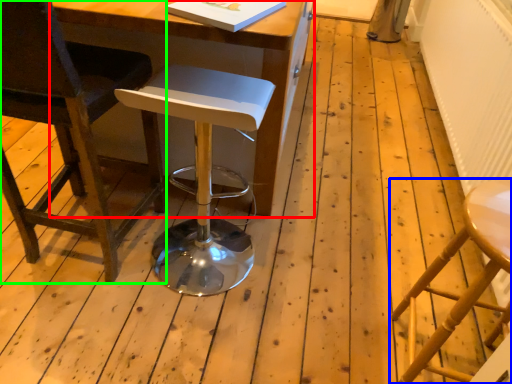
Question: Estimate the real-world distances between objects in this image. Which object is closer to table (highlighted by a red box), stool (highlighted by a blue box) or chair (highlighted by a green box)?

Choices:
 (A) stool
 (B) chair

Answer: (B)